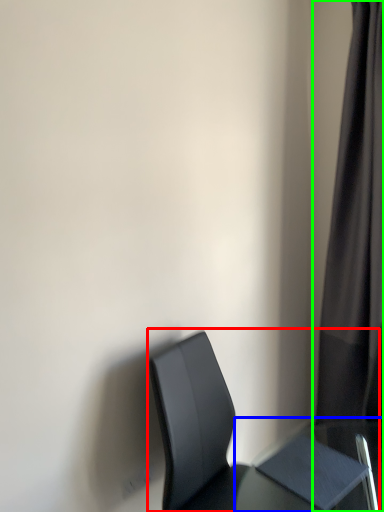
Question: Which object is positioned closest to chair (highlighted by a red box)? Select from table (highlighted by a blue box) and curtain (highlighted by a green box).

Choices:
 (A) table
 (B) curtain

Answer: (A)